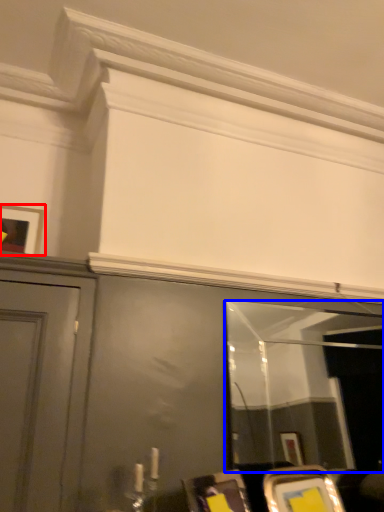
Question: Which object appears closest to the camera in this image, picture frame (highlighted by a red box) or mirror (highlighted by a blue box)?

Choices:
 (A) picture frame
 (B) mirror

Answer: (B)